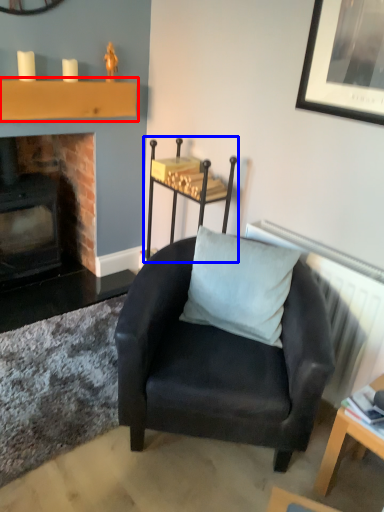
Question: Which point is closer to the camera, shelf (highlighted by a red box) or furniture (highlighted by a blue box)?

Choices:
 (A) shelf
 (B) furniture

Answer: (B)